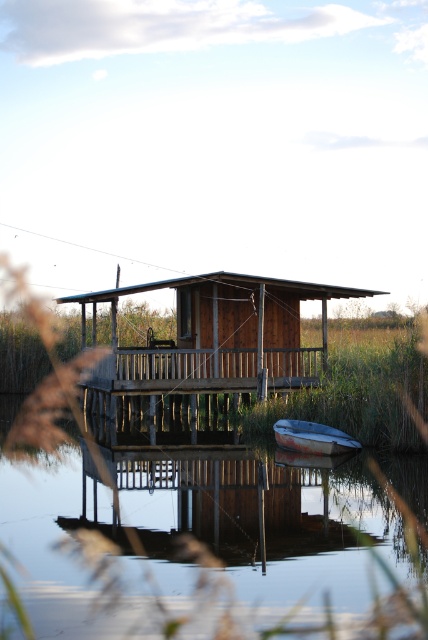
Question: Can you confirm if transparent water at center is smaller than rusty metal boat at lower center?

Choices:
 (A) yes
 (B) no

Answer: (B)

Question: Does transparent water at center appear on the left side of rusty metal boat at lower center?

Choices:
 (A) no
 (B) yes

Answer: (B)

Question: Which point is farther from the camera taking this photo?

Choices:
 (A) (309, 436)
 (B) (186, 483)

Answer: (A)

Question: Can you confirm if transparent water at center is smaller than rusty metal boat at lower center?

Choices:
 (A) yes
 (B) no

Answer: (B)

Question: Among these points, which one is farthest from the camera?

Choices:
 (A) (317, 547)
 (B) (335, 435)

Answer: (B)